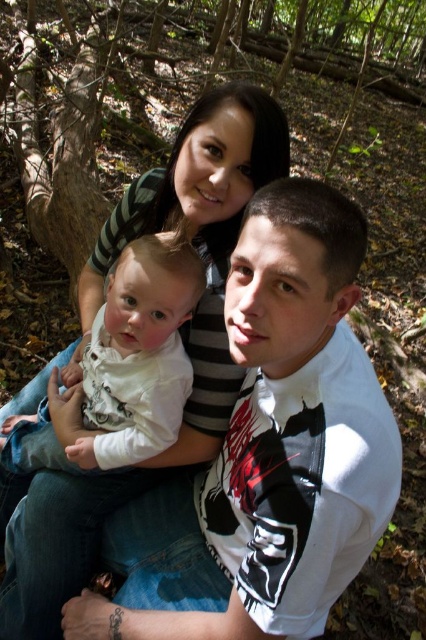
Question: Which object is closer to the camera taking this photo?

Choices:
 (A) white soft fabric baby at center
 (B) striped knit sweater at center
 (C) white matte shirt at center

Answer: (C)

Question: Is striped knit sweater at center positioned behind white soft fabric baby at center?

Choices:
 (A) yes
 (B) no

Answer: (A)

Question: Is the position of white matte shirt at center less distant than that of striped knit sweater at center?

Choices:
 (A) no
 (B) yes

Answer: (B)

Question: Is white matte shirt at center positioned before white soft fabric baby at center?

Choices:
 (A) yes
 (B) no

Answer: (A)

Question: Which object appears farthest from the camera in this image?

Choices:
 (A) white soft fabric baby at center
 (B) white matte shirt at center

Answer: (A)

Question: Which of the following is the farthest from the observer?

Choices:
 (A) striped knit sweater at center
 (B) white matte shirt at center

Answer: (A)